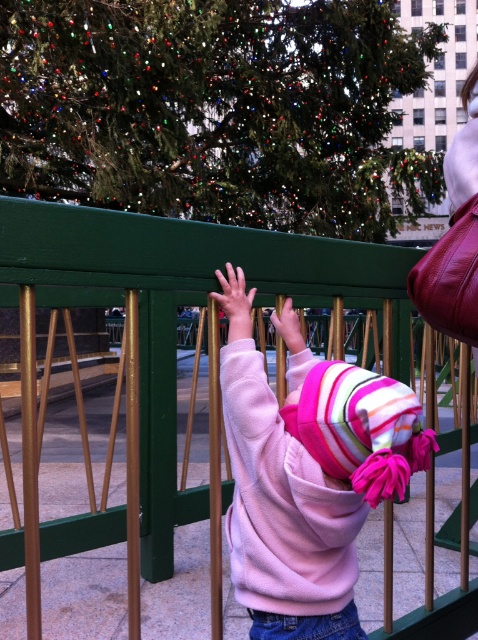
You are a photographer trying to capture a photo of the Christmas tree while keeping both the green painted metal fence at upper center and the pink fleece sweatshirt at center in the frame. Based on their positions, which object should you place on the left side of your camera frame to ensure both are visible?

The pink fleece sweatshirt at center should be placed on the left side of your camera frame because the green painted metal fence at upper center is positioned on the right side of it, ensuring both objects are visible in the frame.

You are a photographer trying to capture the festive scene. You notice two points in the image at coordinates point (268,250) and point (357,406). Which point is closer to your camera lens?

Point (268,250) is further to the camera than point (357,406), so the point closer to the camera lens is point (268,250).

You are a photographer trying to capture the festive lights of the green textured christmas tree at upper center and the green painted metal fence at upper center in the same frame. Based on their positions, which object should you focus on first to ensure both are in the shot?

The green textured christmas tree at upper center is located above the green painted metal fence at upper center. To capture both in the same frame, focus on the green painted metal fence at upper center first since it is lower and closer to the camera, allowing the tree above it to naturally come into view.